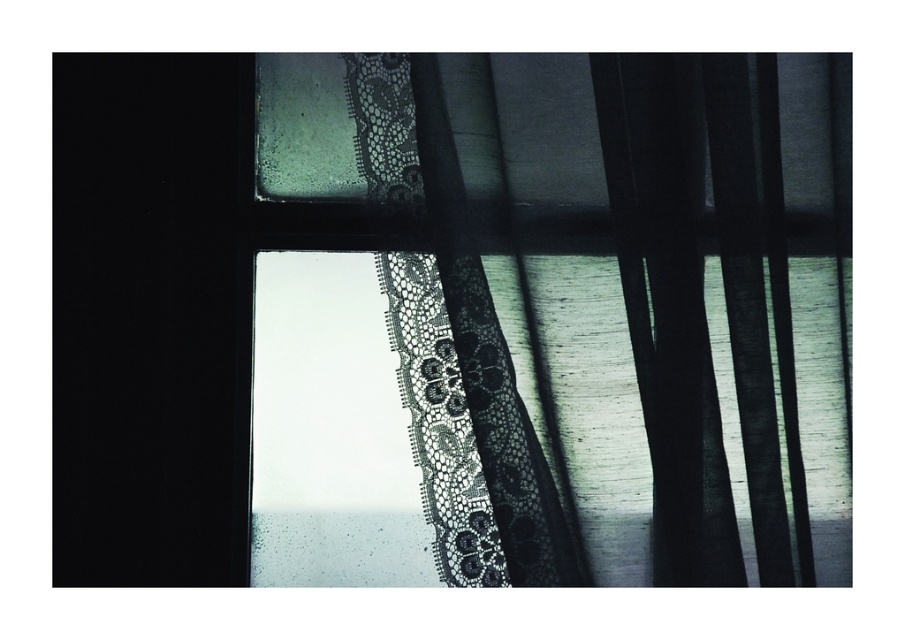
Is black lace curtain at upper center taller than black matte door at left?

Incorrect, black lace curtain at upper center's height is not larger of black matte door at left's.

Who is shorter, black lace curtain at upper center or black matte door at left?

Standing shorter between the two is black lace curtain at upper center.

Locate an element on the screen. black lace curtain at upper center is located at coordinates (578, 316).

In order to click on black lace curtain at upper center in this screenshot , I will do `click(578, 316)`.